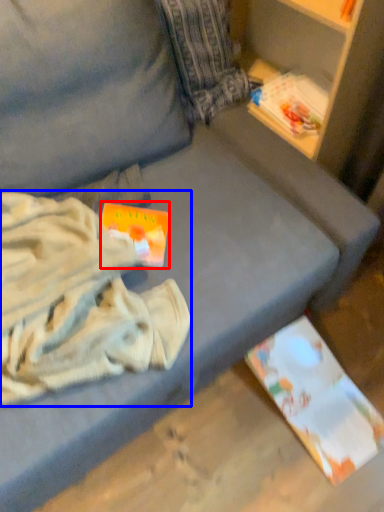
Question: Among these objects, which one is nearest to the camera, paperback book (highlighted by a red box) or clothing (highlighted by a blue box)?

Choices:
 (A) paperback book
 (B) clothing

Answer: (B)